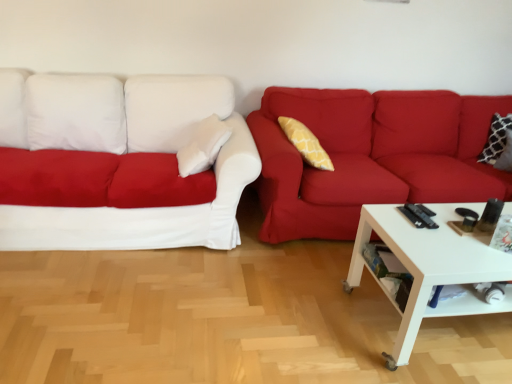
Question: Is matte red couch at right, placed as the 1th studio couch when sorted from right to left, inside white fabric couch at left, placed as the 2th studio couch when sorted from right to left?

Choices:
 (A) yes
 (B) no

Answer: (B)

Question: Is white fabric couch at left, the first studio couch when ordered from left to right, turned away from matte red couch at right, placed as the 1th studio couch when sorted from right to left?

Choices:
 (A) no
 (B) yes

Answer: (A)

Question: Can you confirm if white fabric couch at left, placed as the 2th studio couch when sorted from right to left, is wider than matte red couch at right, which is counted as the second studio couch, starting from the left?

Choices:
 (A) yes
 (B) no

Answer: (A)

Question: Does white fabric couch at left, placed as the 2th studio couch when sorted from right to left, appear on the left side of matte red couch at right, placed as the 1th studio couch when sorted from right to left?

Choices:
 (A) yes
 (B) no

Answer: (A)

Question: From a real-world perspective, is white fabric couch at left, placed as the 2th studio couch when sorted from right to left, beneath matte red couch at right, placed as the 1th studio couch when sorted from right to left?

Choices:
 (A) yes
 (B) no

Answer: (B)

Question: From the image's perspective, is matte red couch at right, placed as the 1th studio couch when sorted from right to left, positioned above or below white glossy coffee table at lower right?

Choices:
 (A) above
 (B) below

Answer: (A)

Question: Is matte red couch at right, placed as the 1th studio couch when sorted from right to left, spatially inside white glossy coffee table at lower right, or outside of it?

Choices:
 (A) inside
 (B) outside

Answer: (B)

Question: Is matte red couch at right, placed as the 1th studio couch when sorted from right to left, to the left or to the right of white glossy coffee table at lower right in the image?

Choices:
 (A) left
 (B) right

Answer: (A)

Question: In the image, is matte red couch at right, which is counted as the second studio couch, starting from the left, positioned in front of or behind white glossy coffee table at lower right?

Choices:
 (A) front
 (B) behind

Answer: (B)

Question: Is point (267, 89) closer or farther from the camera than point (41, 140)?

Choices:
 (A) farther
 (B) closer

Answer: (A)

Question: Looking at their shapes, would you say matte red couch at right, placed as the 1th studio couch when sorted from right to left, is wider or thinner than white fabric couch at left, placed as the 2th studio couch when sorted from right to left?

Choices:
 (A) wide
 (B) thin

Answer: (B)

Question: Relative to white fabric couch at left, placed as the 2th studio couch when sorted from right to left, is matte red couch at right, placed as the 1th studio couch when sorted from right to left, in front or behind?

Choices:
 (A) front
 (B) behind

Answer: (B)

Question: Is matte red couch at right, placed as the 1th studio couch when sorted from right to left, situated inside white fabric couch at left, the first studio couch when ordered from left to right, or outside?

Choices:
 (A) inside
 (B) outside

Answer: (B)

Question: From the image's perspective, is white fabric couch at left, placed as the 2th studio couch when sorted from right to left, positioned above or below matte red couch at right, which is counted as the second studio couch, starting from the left?

Choices:
 (A) below
 (B) above

Answer: (B)

Question: From a real-world perspective, is white fabric couch at left, placed as the 2th studio couch when sorted from right to left, positioned above or below matte red couch at right, placed as the 1th studio couch when sorted from right to left?

Choices:
 (A) above
 (B) below

Answer: (A)